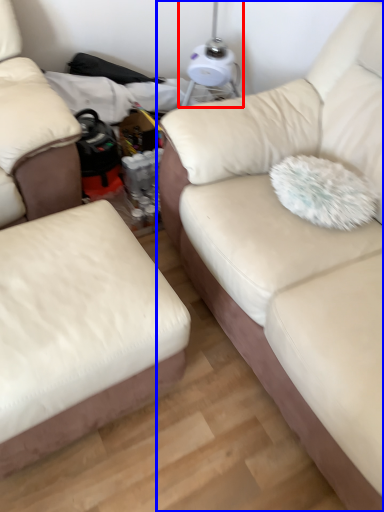
Question: Which object appears farthest to the camera in this image, table lamp (highlighted by a red box) or studio couch (highlighted by a blue box)?

Choices:
 (A) table lamp
 (B) studio couch

Answer: (A)